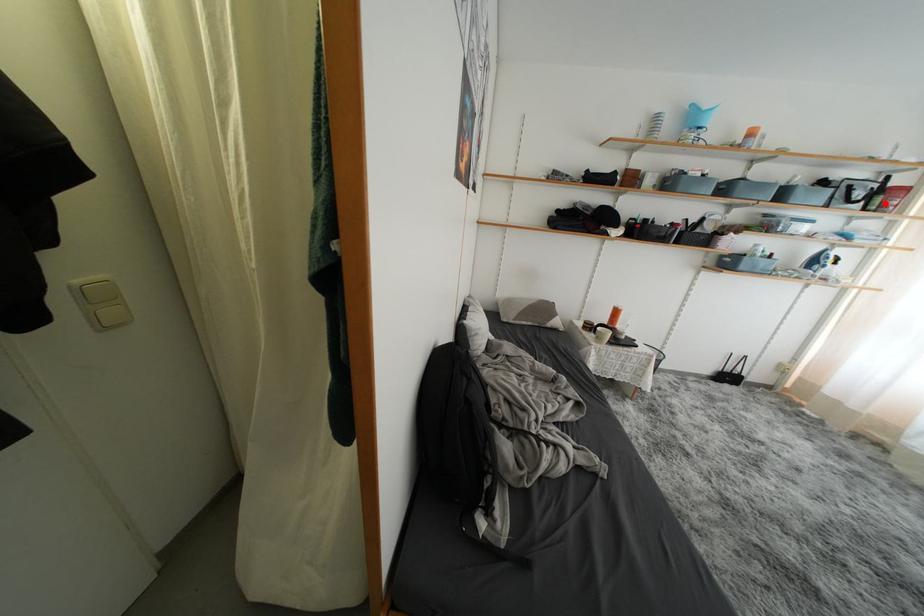
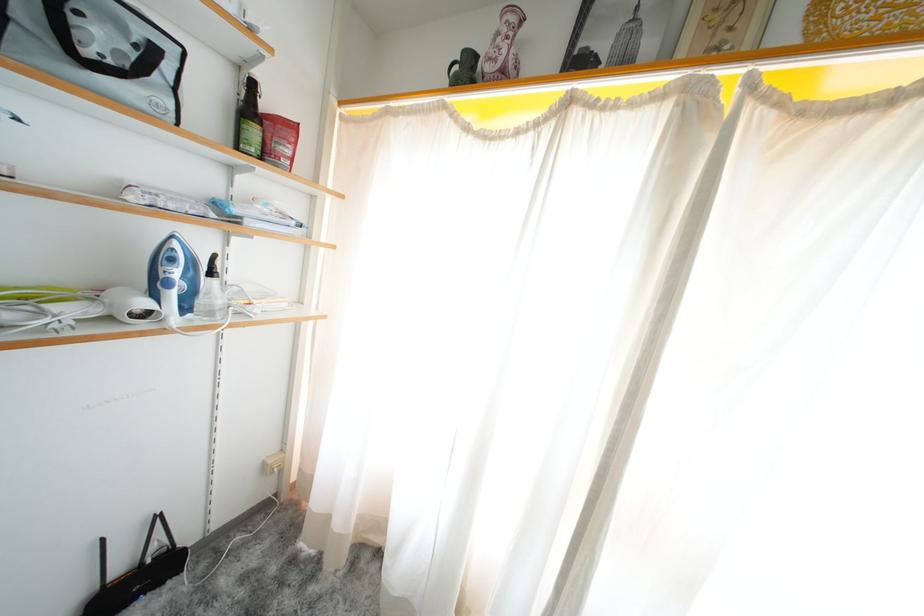
Question: I am providing you with two images of the same scene from different viewpoints. A red point is shown in image1. For the corresponding object point in image2, is it positioned nearer or farther from the camera?

Choices:
 (A) Nearer
 (B) Farther

Answer: (A)